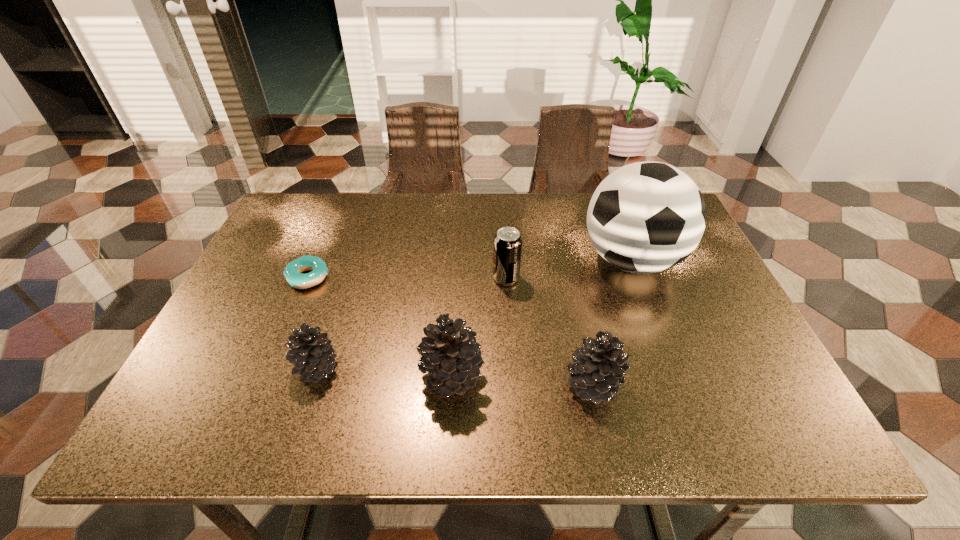
Choose which pinecone is the second nearest neighbor to the second pinecone from left to right. Please provide its 2D coordinates. Your answer should be formatted as a tuple, i.e. [(x, y)], where the tuple contains the x and y coordinates of a point satisfying the conditions above.

[(312, 352)]

You are a GUI agent. You are given a task and a screenshot of the screen. Output one action in this format:
    pyautogui.click(x=<x>, y=<y>)
    Task: Click on the pinecone that stands as the second closest to the shortest object
    
    Given the screenshot: What is the action you would take?
    pyautogui.click(x=450, y=353)

Locate an element on the screen. This screenshot has width=960, height=540. blank space that satisfies the following two spatial constraints: 1. on the front side of the shortest object; 2. on the left side of the fifth tallest object is located at coordinates (271, 369).

This screenshot has width=960, height=540. Identify the location of vacant space that satisfies the following two spatial constraints: 1. on the front side of the third object from left to right; 2. on the right side of the rightmost pinecone. (452, 384).

Image resolution: width=960 pixels, height=540 pixels. Identify the location of free space in the image that satisfies the following two spatial constraints: 1. on the front side of the fourth object from right to left; 2. on the left side of the doughnut. (267, 376).

Identify the location of vacant region that satisfies the following two spatial constraints: 1. on the back side of the third object from left to right; 2. on the right side of the soccer ball. (459, 260).